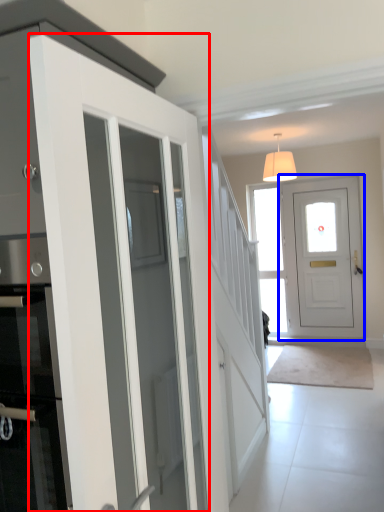
Question: Among these objects, which one is nearest to the camera, door (highlighted by a red box) or door (highlighted by a blue box)?

Choices:
 (A) door
 (B) door

Answer: (A)